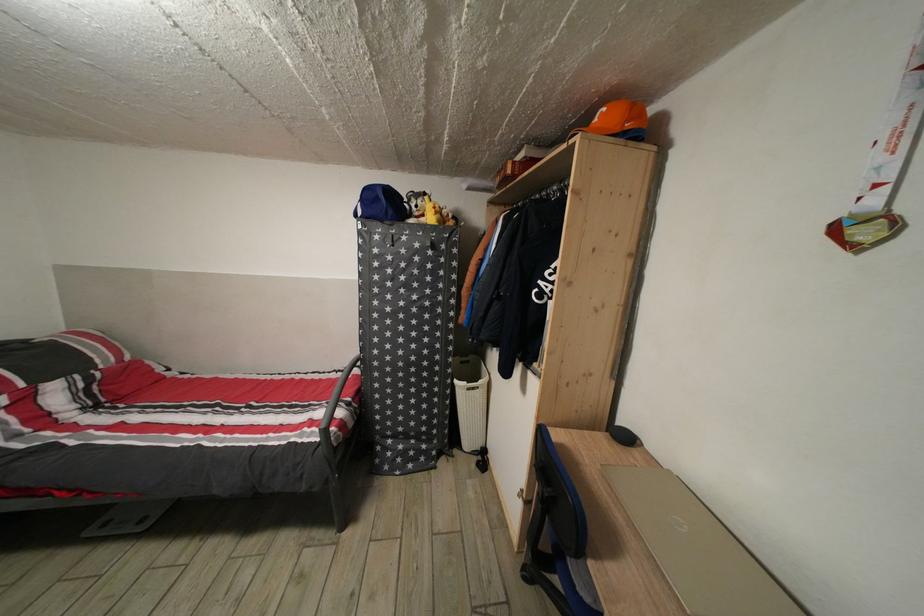
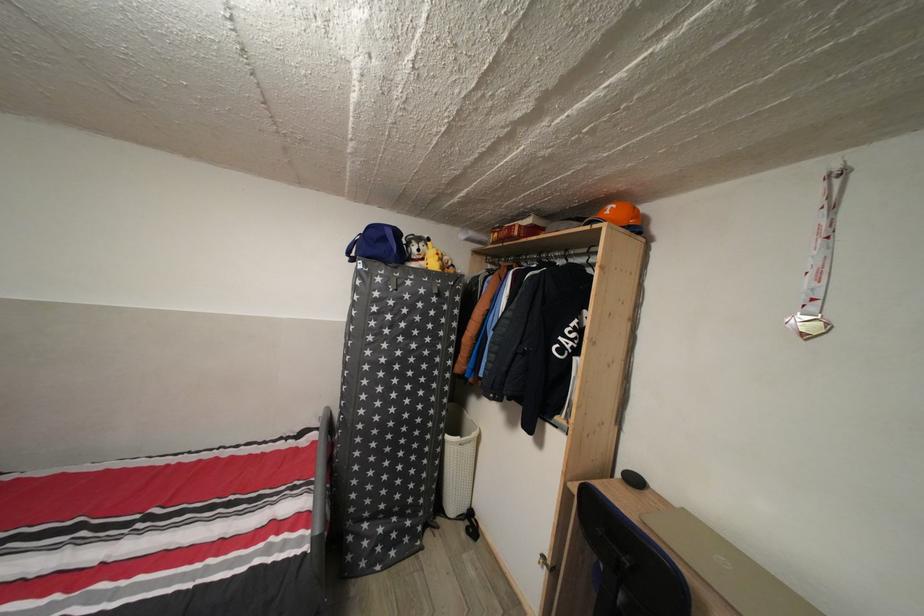
The point at (395, 387) is marked in the first image. Where is the corresponding point in the second image?

(380, 451)